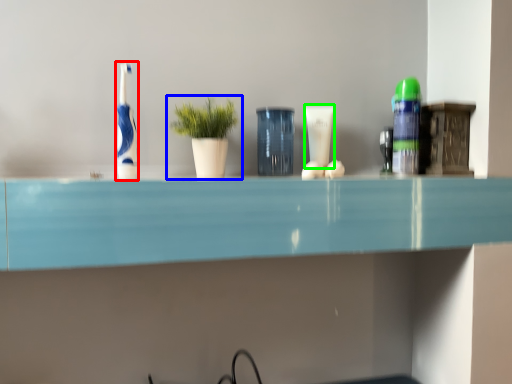
Question: Which object is the farthest from toothbrush (highlighted by a red box)? Choose among these: houseplant (highlighted by a blue box) or toiletry (highlighted by a green box).

Choices:
 (A) houseplant
 (B) toiletry

Answer: (B)